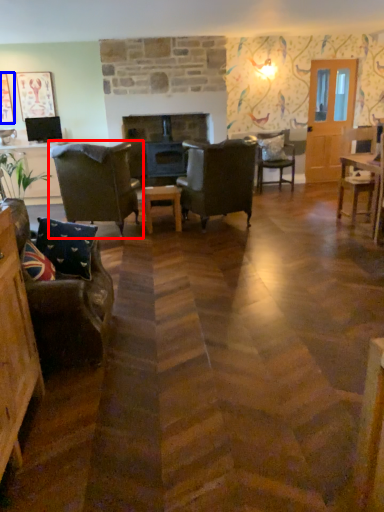
Question: Among these objects, which one is nearest to the camera, chair (highlighted by a red box) or picture frame (highlighted by a blue box)?

Choices:
 (A) chair
 (B) picture frame

Answer: (A)